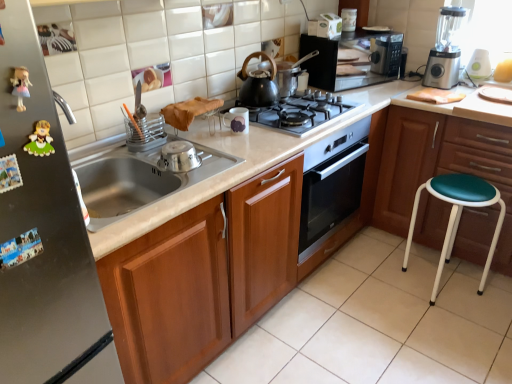
Where is `free space above teal vinyl stool at lower right (from a real-world perspective)`? This screenshot has height=384, width=512. free space above teal vinyl stool at lower right (from a real-world perspective) is located at coordinates (468, 190).